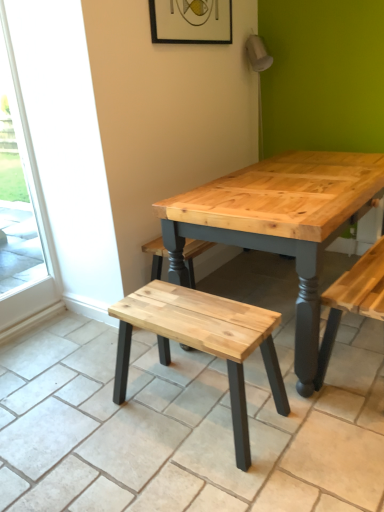
Question: Is wooden frame at upper center bigger or smaller than natural wood stool at center?

Choices:
 (A) big
 (B) small

Answer: (B)

Question: Considering the positions of point (208, 25) and point (248, 349), is point (208, 25) closer or farther from the camera than point (248, 349)?

Choices:
 (A) farther
 (B) closer

Answer: (A)

Question: Which object is the farthest from the natural wood stool at center?

Choices:
 (A) transparent glass screen door at left
 (B) wooden frame at upper center

Answer: (B)

Question: Considering the real-world distances, which object is closest to the wooden frame at upper center?

Choices:
 (A) natural wood stool at center
 (B) transparent glass screen door at left

Answer: (B)